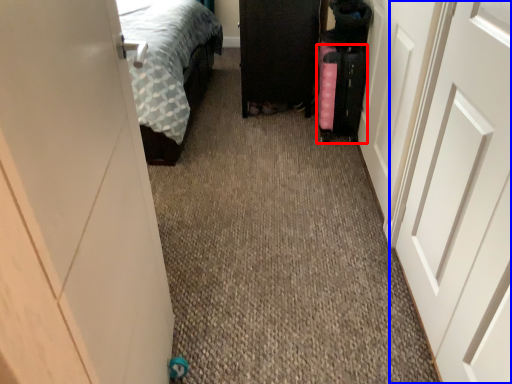
Question: Which point is closer to the camera, luggage (highlighted by a red box) or door (highlighted by a blue box)?

Choices:
 (A) luggage
 (B) door

Answer: (B)